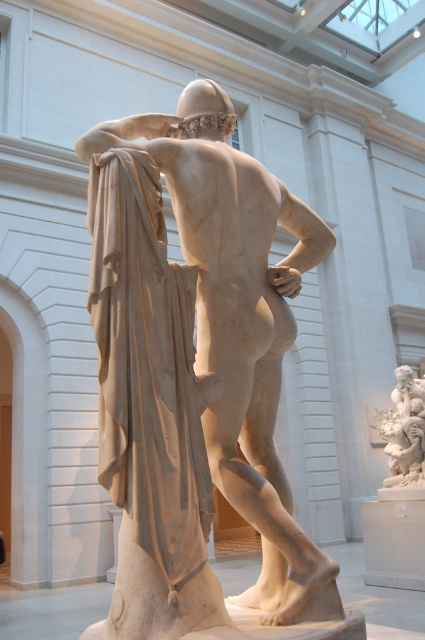
Question: Where is white marble statue at center located in relation to white marble cherub at right in the image?

Choices:
 (A) left
 (B) right

Answer: (A)

Question: Which object is closer to the camera taking this photo?

Choices:
 (A) white marble cherub at right
 (B) white marble statue at center

Answer: (B)

Question: Does white marble statue at center appear on the right side of white marble cherub at right?

Choices:
 (A) no
 (B) yes

Answer: (A)

Question: Among these points, which one is nearest to the camera?

Choices:
 (A) (249, 276)
 (B) (405, 394)

Answer: (A)

Question: Can you confirm if white marble statue at center is thinner than white marble cherub at right?

Choices:
 (A) no
 (B) yes

Answer: (B)